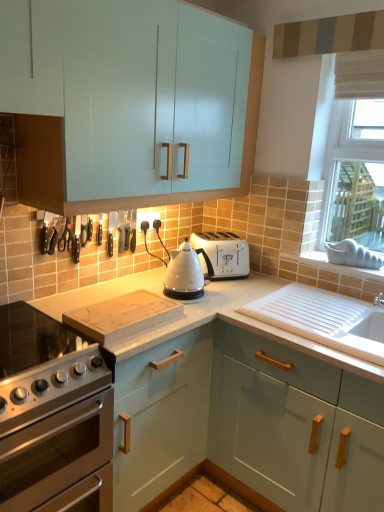
Question: Considering the relative positions of satin silver gas stove at lower left and glossy teal cabinet at lower right, which appears as the second cabinetry when viewed from the top, in the image provided, is satin silver gas stove at lower left to the left or to the right of glossy teal cabinet at lower right, which appears as the second cabinetry when viewed from the top,?

Choices:
 (A) left
 (B) right

Answer: (A)

Question: In terms of width, does satin silver gas stove at lower left look wider or thinner when compared to glossy teal cabinet at lower right, which is the first cabinetry in bottom-to-top order?

Choices:
 (A) thin
 (B) wide

Answer: (B)

Question: Estimate the real-world distances between objects in this image. Which object is farther from the wooden cutting board at center?

Choices:
 (A) white marble cutting board at lower center
 (B) matte striped panel at upper center
 (C) white ceramic sink at lower right
 (D) stainless steel oven at lower left
 (E) white plastic toaster at upper center

Answer: (B)

Question: Which object is the closest to the white ceramic sink at lower right?

Choices:
 (A) white plastic toaster at upper center
 (B) wooden cutting board at center
 (C) glossy teal cabinet at lower right, which is the first cabinetry in bottom-to-top order
 (D) white marble cutting board at lower center
 (E) white fabric window at upper right

Answer: (C)